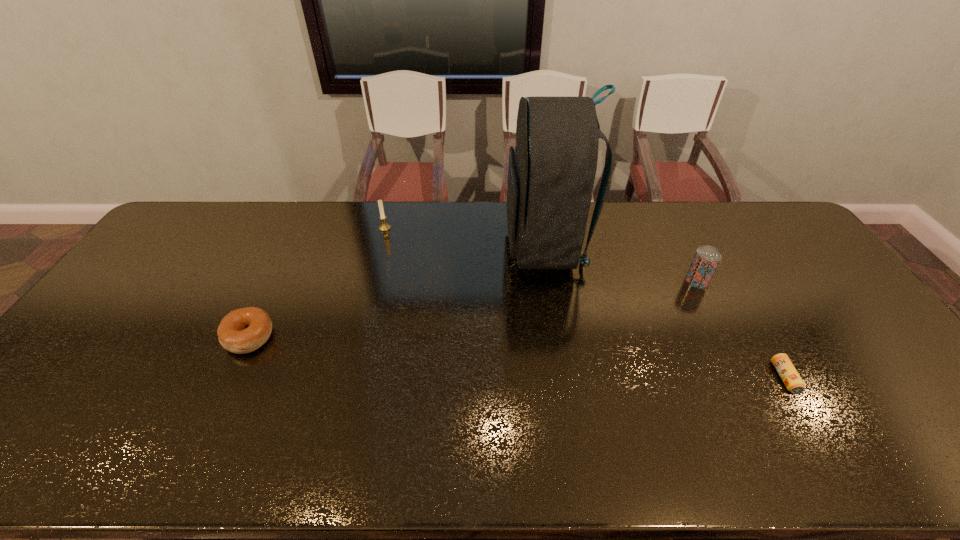
This screenshot has width=960, height=540. Identify the location of vacant space located on the front-facing side of the third object from left to right. (421, 245).

I want to click on blank space located on the front-facing side of the third object from left to right, so click(410, 245).

What are the coordinates of `free space located 0.110m on the back of the fourth object from right to left` in the screenshot? It's located at (391, 207).

Where is `vacant space located on the back of the fourth object from left to right`? This screenshot has width=960, height=540. vacant space located on the back of the fourth object from left to right is located at coordinates (664, 216).

Where is `blank space located on the right of the leftmost object`? Image resolution: width=960 pixels, height=540 pixels. blank space located on the right of the leftmost object is located at coordinates [x=406, y=337].

The height and width of the screenshot is (540, 960). What are the coordinates of `free location located 0.310m on the back of the shorter beer can` in the screenshot? It's located at (727, 278).

Image resolution: width=960 pixels, height=540 pixels. I want to click on backpack at the far edge, so click(551, 173).

The height and width of the screenshot is (540, 960). Identify the location of candle holder that is positioned at the far edge. (384, 227).

The height and width of the screenshot is (540, 960). In the image, there is a desktop. Identify the location of vacant region at the far edge. (609, 233).

In the image, there is a desktop. What are the coordinates of `vacant space at the near edge` in the screenshot? It's located at (340, 446).